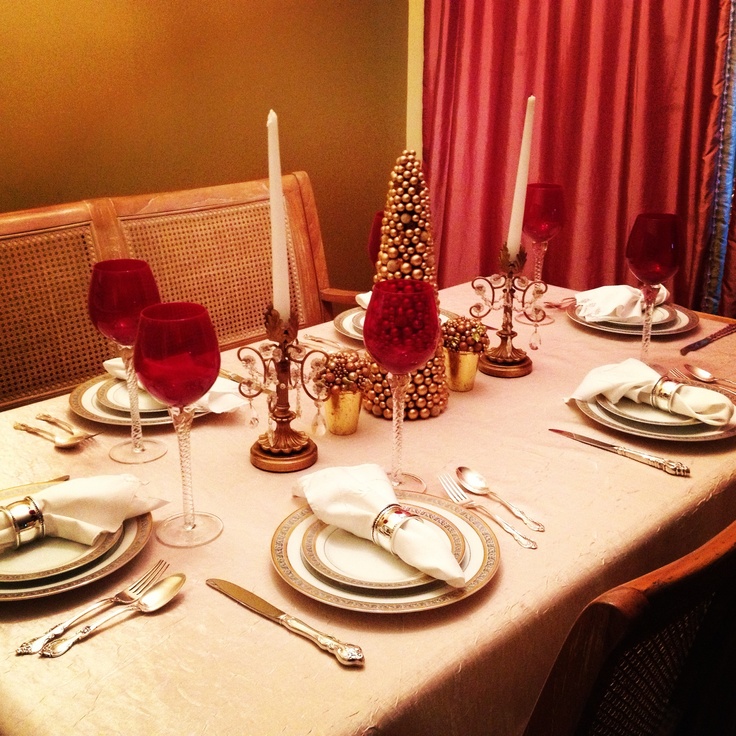
Locate an element on the screen. The width and height of the screenshot is (736, 736). decorations is located at coordinates (279, 330), (341, 400), (419, 394), (461, 355), (508, 318).